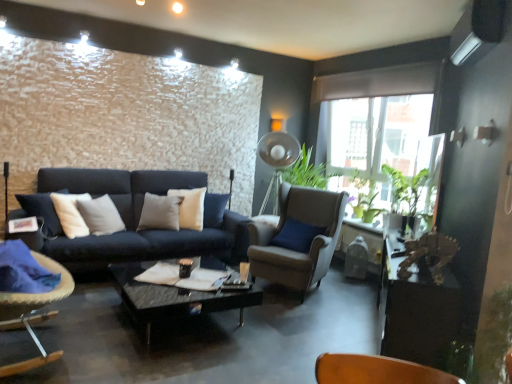
Question: Is point (434, 307) closer or farther from the camera than point (117, 281)?

Choices:
 (A) closer
 (B) farther

Answer: (A)

Question: Considering the positions of wooden table at right and black glass coffee table at center in the image, is wooden table at right bigger or smaller than black glass coffee table at center?

Choices:
 (A) small
 (B) big

Answer: (B)

Question: Which of these objects is positioned closest to the velvet cushioned chair at left, which ranks as the 2th chair in right-to-left order?

Choices:
 (A) suede beige armchair at center, positioned as the second chair in left-to-right order
 (B) black glass coffee table at center
 (C) green matte plant at right
 (D) wooden table at right

Answer: (B)

Question: Which is nearer to the black glass coffee table at center?

Choices:
 (A) suede beige armchair at center, positioned as the second chair in left-to-right order
 (B) velvet cushioned chair at left, the first chair from the front
 (C) green matte plant at right
 (D) wooden table at right

Answer: (B)